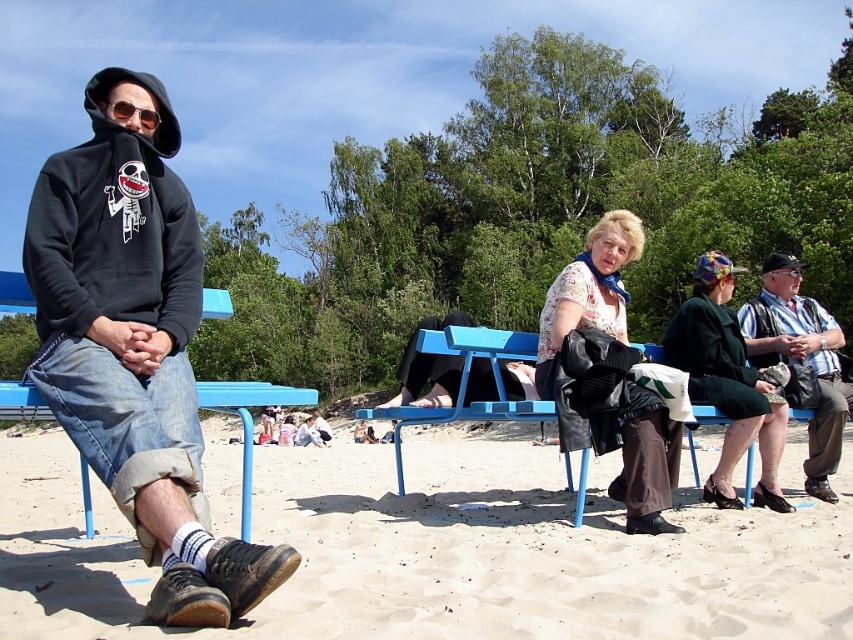
Question: Which object is positioned closest to the green fabric vest at right?

Choices:
 (A) blue plastic bench at left
 (B) blue plastic bench at center
 (C) black matte hoodie at left

Answer: (B)

Question: Which object appears farthest from the camera in this image?

Choices:
 (A) matte black hoodie at center
 (B) green fabric coat at center
 (C) floral print blouse at center
 (D) green fabric vest at right

Answer: (D)

Question: Does black matte hoodie at left appear under blue plastic bench at left?

Choices:
 (A) no
 (B) yes

Answer: (A)

Question: Which point is closer to the camera taking this photo?

Choices:
 (A) (109, 164)
 (B) (741, 419)
 (C) (549, 358)

Answer: (A)

Question: Is matte black hoodie at center to the left of blue plastic bench at left from the viewer's perspective?

Choices:
 (A) no
 (B) yes

Answer: (A)

Question: Can you confirm if brown leather shoes at lower left is positioned to the right of green fabric coat at center?

Choices:
 (A) yes
 (B) no

Answer: (B)